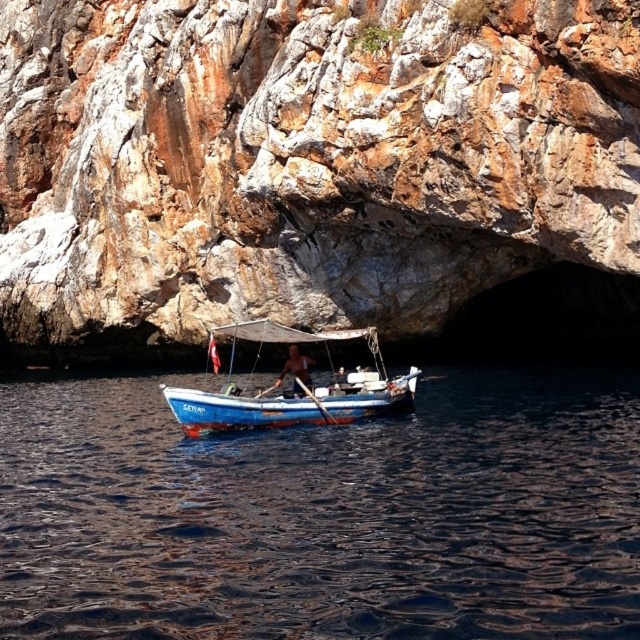
You are a sailor on the blue painted wood boat at center near the rusty stone cave at center. You want to dock your boat inside the cave. Can your boat fit inside the cave?

The rusty stone cave at center has a larger size compared to blue painted wood boat at center, so yes, the boat can fit inside the cave.

You are standing on the cliff and see the dark blue water at center and the blue painted wood boat at center. Which object is located lower in the scene?

The dark blue water at center is located lower than the blue painted wood boat at center.

In the scene shown: You are an observer standing on the cliff looking down at the blue painted wood boat at center and the brown wooden oar at center. If you were to estimate their sizes, which object is wider?

The blue painted wood boat at center is wider than the brown wooden oar at center as per the description.